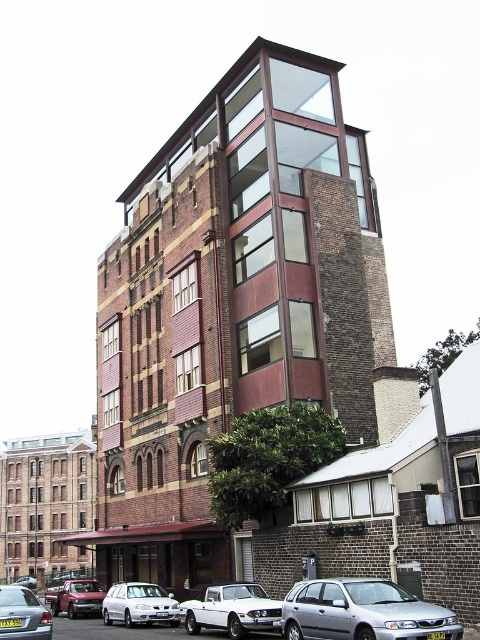
You are a delivery driver who needs to park your vehicle next to the silver metallic sedan at lower left. The parking spot next to it is only wide enough for a compact car. Can your white glossy pickup truck at lower center fit into that space?

The white glossy pickup truck at lower center is positioned on the right side of the silver metallic sedan at lower left. Since pickup trucks are typically larger than compact cars, it might not fit in the parking spot designated for compact cars.

You are a delivery driver who needs to park your vehicle in the parking lot near the building. The parking spots are all 2 meters wide. You have a white glossy pickup truck at lower center and a silver metallic sedan at lower left. Which vehicle can fit into the parking spot without needing to adjust its position?

The silver metallic sedan at lower left can fit into the parking spot without needing to adjust its position because the white glossy pickup truck at lower center is wider than the silver metallic sedan at lower left, and the parking spot is 2 meters wide.

You are standing in front of the building and notice two points marked on its facade. The first point is at coordinates point (x=345, y=634) and the second is at point (x=275, y=602). Which of these points is closer to you as you face the building?

Point (x=345, y=634) is in front of point (x=275, y=602), so it is closer to you as you face the building.